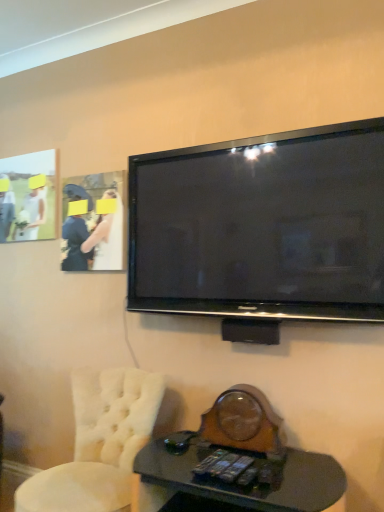
The width and height of the screenshot is (384, 512). What are the coordinates of `blank space situated above black glass desk at lower center (from a real-world perspective)` in the screenshot? It's located at (225, 477).